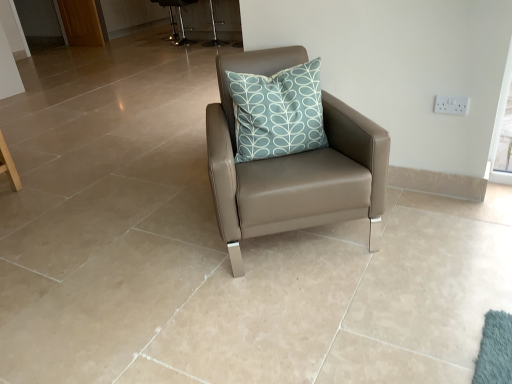
Question: Is matte leather chair at center closer to the viewer compared to brown wooden screen door at upper left?

Choices:
 (A) yes
 (B) no

Answer: (A)

Question: Can you confirm if matte leather chair at center is positioned to the left of brown wooden screen door at upper left?

Choices:
 (A) yes
 (B) no

Answer: (B)

Question: From a real-world perspective, is matte leather chair at center located beneath brown wooden screen door at upper left?

Choices:
 (A) no
 (B) yes

Answer: (B)

Question: Is brown wooden screen door at upper left a part of matte leather chair at center?

Choices:
 (A) yes
 (B) no

Answer: (B)

Question: Can you see matte leather chair at center touching brown wooden screen door at upper left?

Choices:
 (A) no
 (B) yes

Answer: (A)

Question: Considering the relative sizes of matte leather chair at center and brown wooden screen door at upper left in the image provided, is matte leather chair at center thinner than brown wooden screen door at upper left?

Choices:
 (A) yes
 (B) no

Answer: (B)

Question: Is transparent glass window screen at upper right looking in the opposite direction of matte leather chair at center?

Choices:
 (A) yes
 (B) no

Answer: (B)

Question: Is transparent glass window screen at upper right at the right side of matte leather chair at center?

Choices:
 (A) no
 (B) yes

Answer: (B)

Question: Is transparent glass window screen at upper right not near matte leather chair at center?

Choices:
 (A) yes
 (B) no

Answer: (B)

Question: Can you confirm if transparent glass window screen at upper right is smaller than matte leather chair at center?

Choices:
 (A) yes
 (B) no

Answer: (A)

Question: Does transparent glass window screen at upper right contain matte leather chair at center?

Choices:
 (A) yes
 (B) no

Answer: (B)

Question: Can you confirm if transparent glass window screen at upper right is bigger than matte leather chair at center?

Choices:
 (A) yes
 (B) no

Answer: (B)

Question: Is metallic silver bar stool at upper center, arranged as the second bar stool when viewed from the left, bigger than metallic silver bar stool at upper center, the first bar stool when ordered from left to right?

Choices:
 (A) yes
 (B) no

Answer: (A)